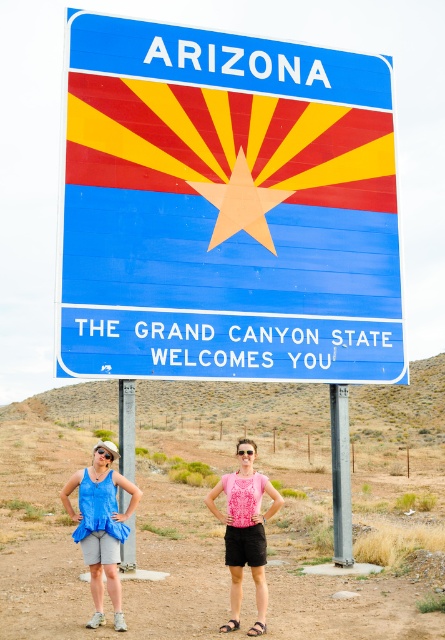
Question: Is pink fabric top at center further to the viewer compared to gray metallic pole at center?

Choices:
 (A) no
 (B) yes

Answer: (A)

Question: Which object appears closest to the camera in this image?

Choices:
 (A) gray metallic pole at center
 (B) blue fabric tank top at center
 (C) metallic pole at center

Answer: (B)

Question: Among these objects, which one is nearest to the camera?

Choices:
 (A) pink fabric top at center
 (B) metallic pole at center

Answer: (A)

Question: Is blue fabric tank top at center in front of metallic pole at center?

Choices:
 (A) no
 (B) yes

Answer: (B)

Question: Does blue fabric tank top at center have a smaller size compared to metallic pole at center?

Choices:
 (A) yes
 (B) no

Answer: (B)

Question: Which point appears farthest from the camera in this image?

Choices:
 (A) (121, 515)
 (B) (129, 436)
 (C) (250, 627)

Answer: (B)